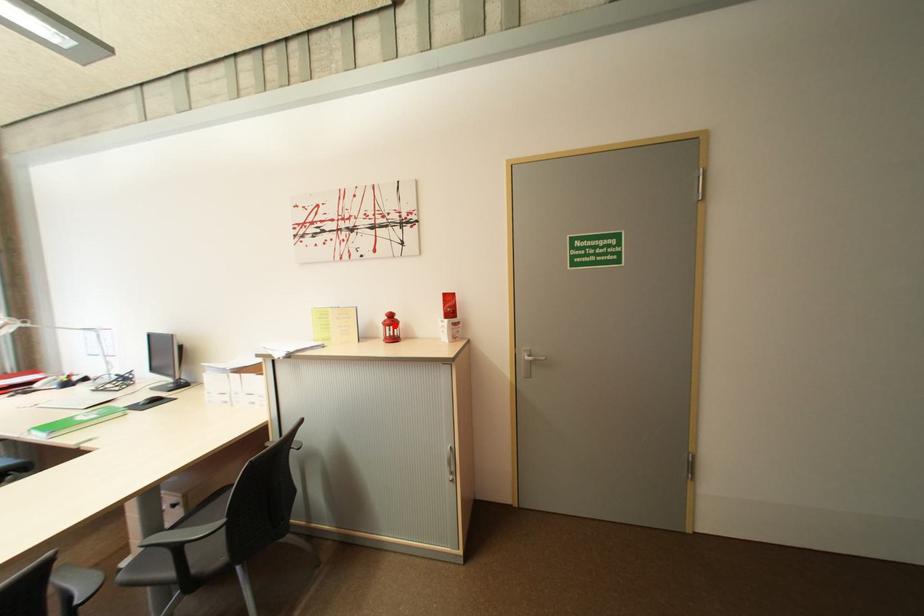
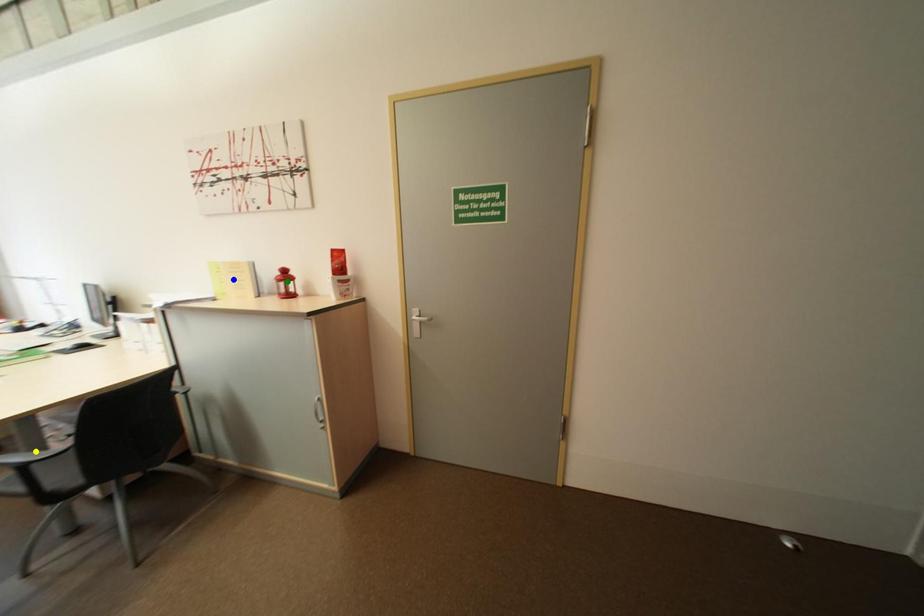
Question: I am providing you with two images of the same scene from different viewpoints. A red point is marked on the first image. You are given multiple points on the second image. Which point in image 2 represents the same 3d spot as the red point in image 1?

Choices:
 (A) yellow point
 (B) green point
 (C) blue point

Answer: (B)